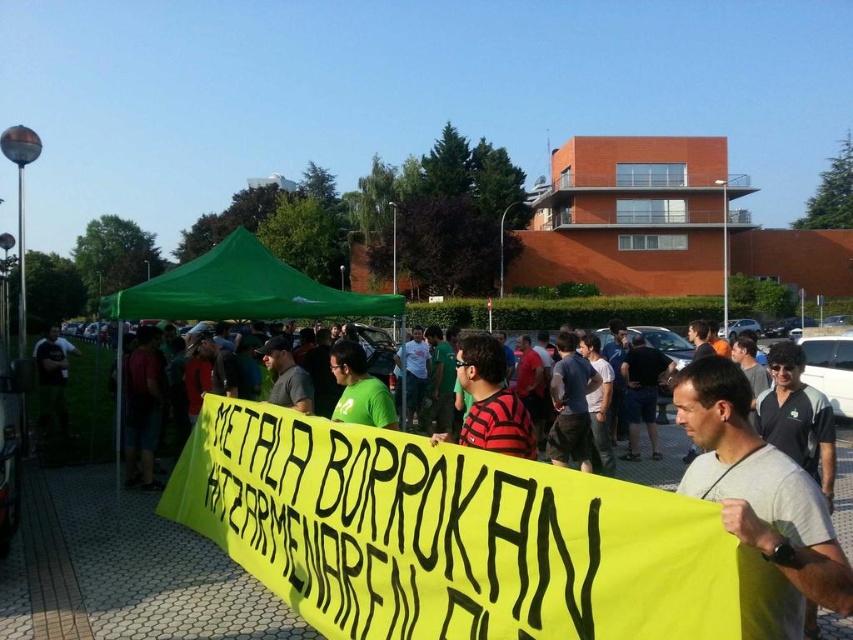
Question: Which point is closer to the camera?

Choices:
 (A) gray fabric at center
 (B) green fabric canopy at center

Answer: (A)

Question: Can you confirm if green fabric canopy at center is thinner than striped cotton shirt at center?

Choices:
 (A) no
 (B) yes

Answer: (A)

Question: From the image, what is the correct spatial relationship of gray fabric at center in relation to striped cotton shirt at center?

Choices:
 (A) above
 (B) below

Answer: (A)

Question: Can you confirm if gray fabric at center is thinner than green fabric canopy at center?

Choices:
 (A) no
 (B) yes

Answer: (B)

Question: Which object appears farthest from the camera in this image?

Choices:
 (A) striped cotton shirt at center
 (B) green fabric canopy at center
 (C) gray fabric at center

Answer: (B)

Question: Which object is positioned closest to the gray fabric at center?

Choices:
 (A) green fabric canopy at center
 (B) striped cotton shirt at center

Answer: (B)